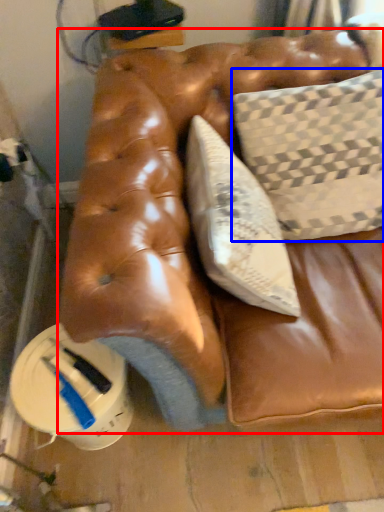
Question: Which point is closer to the camera, furniture (highlighted by a red box) or pillow (highlighted by a blue box)?

Choices:
 (A) furniture
 (B) pillow

Answer: (A)